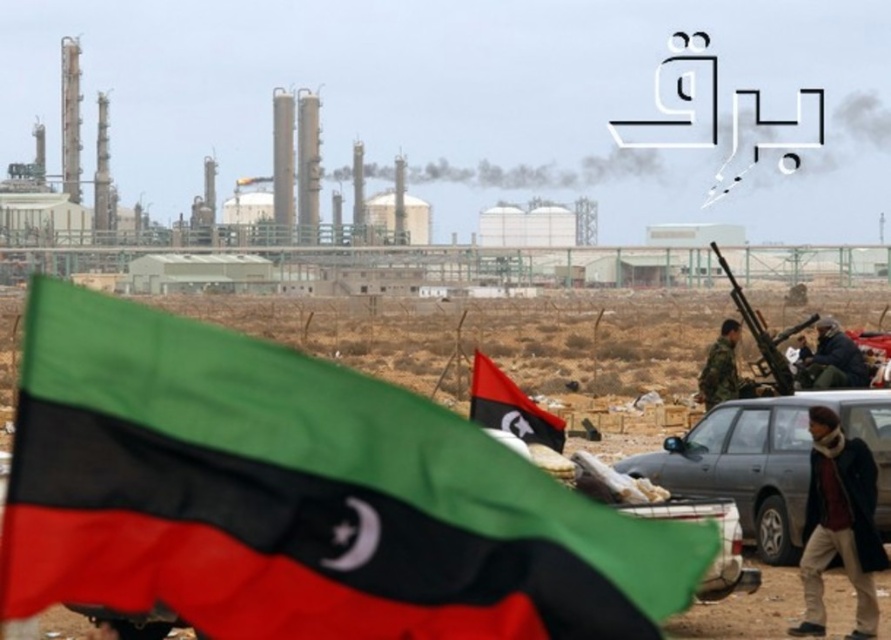
Is polyester flag at lower left taller than camouflage uniform at right?

Yes, polyester flag at lower left is taller than camouflage uniform at right.

Is polyester flag at lower left bigger than camouflage uniform at right?

Indeed, polyester flag at lower left has a larger size compared to camouflage uniform at right.

Who is more forward, (200, 518) or (736, 392)?

Point (200, 518)

Where is `polyester flag at lower left`? The height and width of the screenshot is (640, 891). polyester flag at lower left is located at coordinates (297, 497).

Does matte gray car at lower right have a greater width compared to camouflage uniform at right?

Yes.

Is matte gray car at lower right bigger than camouflage uniform at right?

Yes.

I want to click on matte gray car at lower right, so click(x=767, y=461).

The image size is (891, 640). What do you see at coordinates (511, 406) in the screenshot? I see `red matte flag at center` at bounding box center [511, 406].

Describe the element at coordinates (511, 406) in the screenshot. This screenshot has height=640, width=891. I see `red matte flag at center` at that location.

This screenshot has height=640, width=891. I want to click on red matte flag at center, so click(x=511, y=406).